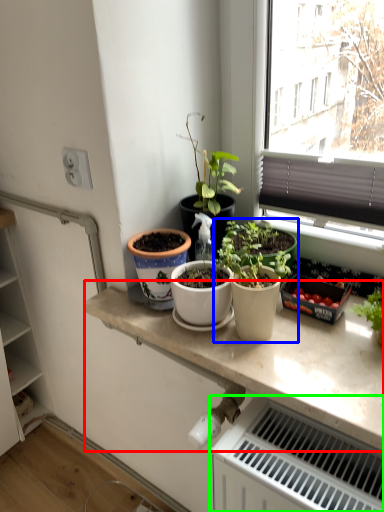
Question: Which is nearer to the countertop (highlighted by a red box)? houseplant (highlighted by a blue box) or radiator (highlighted by a green box).

Choices:
 (A) houseplant
 (B) radiator

Answer: (A)